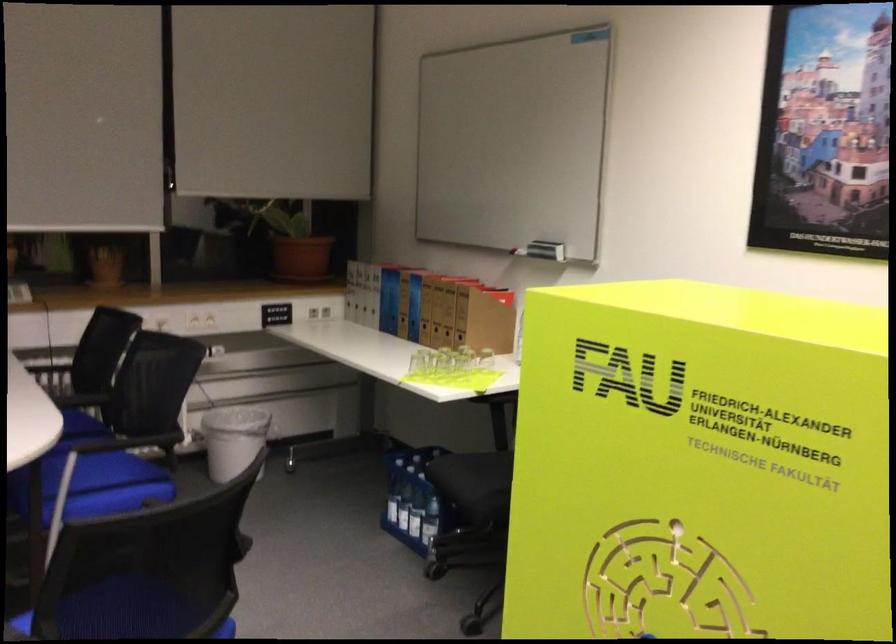
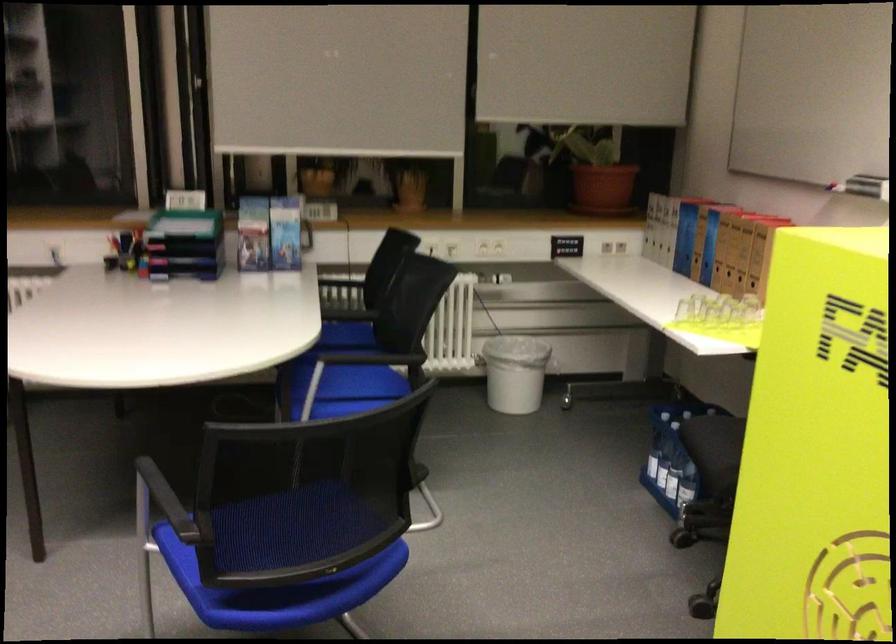
In the second image, find the point that corresponds to the point at 438,365 in the first image.

(713, 310)